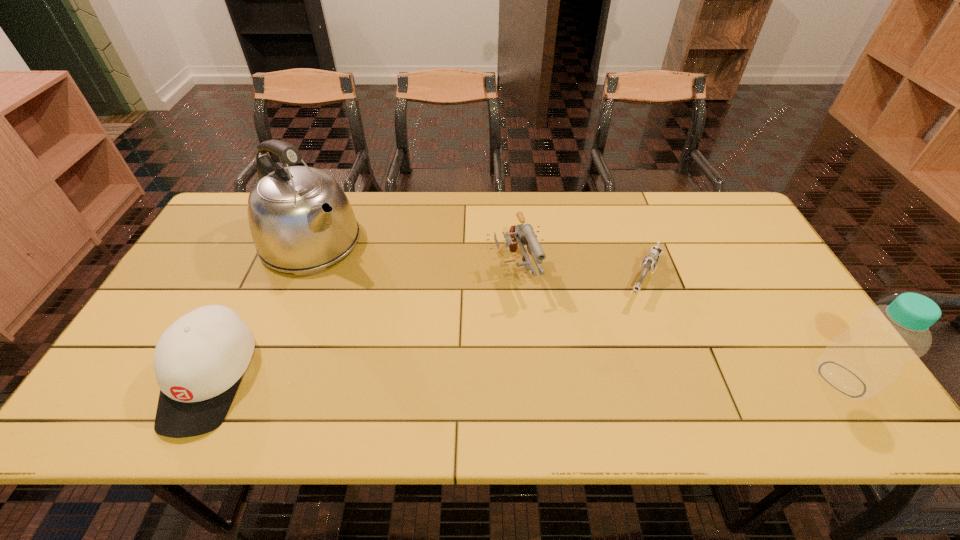
The image size is (960, 540). What are the coordinates of `bottle located at the near edge` in the screenshot? It's located at (859, 363).

Image resolution: width=960 pixels, height=540 pixels. Identify the location of object that is at the left edge. (199, 361).

This screenshot has width=960, height=540. Find the location of `object that is at the right edge`. object that is at the right edge is located at coordinates (859, 363).

At what (x,y) coordinates should I click in order to perform the action: click on object that is positioned at the near left corner. Please return your answer as a coordinate pair (x, y). This screenshot has width=960, height=540. Looking at the image, I should click on (199, 361).

Image resolution: width=960 pixels, height=540 pixels. I want to click on object at the near right corner, so click(859, 363).

The height and width of the screenshot is (540, 960). In the image, there is a desktop. Find the location of `vacant space at the far edge`. vacant space at the far edge is located at coordinates (540, 195).

In the image, there is a desktop. At what (x,y) coordinates should I click in order to perform the action: click on blank space at the near edge. Please return your answer as a coordinate pair (x, y). The height and width of the screenshot is (540, 960). Looking at the image, I should click on (501, 366).

The width and height of the screenshot is (960, 540). Identify the location of vacant area at the left edge of the desktop. (245, 241).

This screenshot has width=960, height=540. In the image, there is a desktop. In order to click on vacant space at the right edge in this screenshot , I will do `click(777, 313)`.

Where is `free location at the near left corner`? free location at the near left corner is located at coordinates (150, 373).